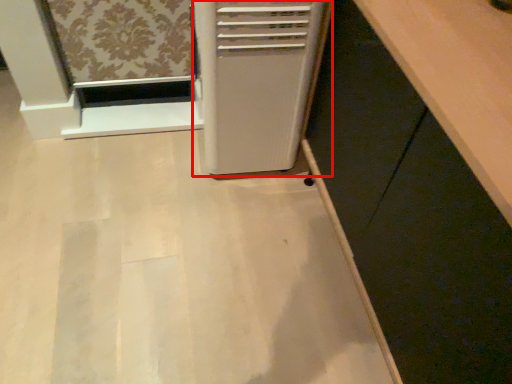
Question: Considering the relative positions of home appliance (annotated by the red box) and cabinetry in the image provided, where is home appliance (annotated by the red box) located with respect to the staircase?

Choices:
 (A) left
 (B) right

Answer: (A)